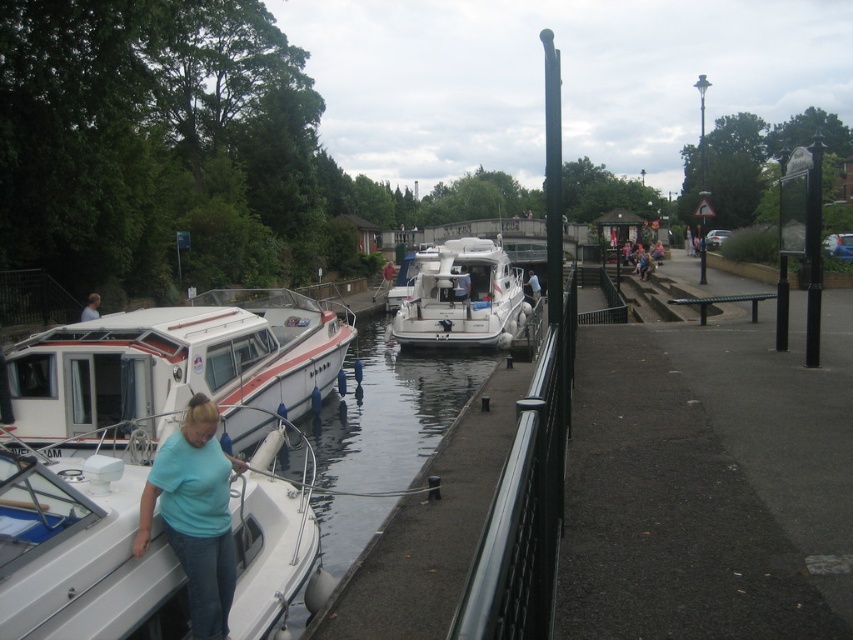
Question: Does light blue cotton shirt at lower left have a greater width compared to light blue shirt at lower left?

Choices:
 (A) no
 (B) yes

Answer: (B)

Question: Does white glossy boat at left appear under white glossy motorboat at center?

Choices:
 (A) no
 (B) yes

Answer: (B)

Question: Which point is closer to the camera taking this photo?

Choices:
 (A) (277, 554)
 (B) (531, 288)

Answer: (A)

Question: Which of the following is the farthest from the observer?

Choices:
 (A) tap(57, 547)
 (B) tap(538, 298)
 (C) tap(210, 412)

Answer: (B)

Question: Which point is farther to the camera?

Choices:
 (A) white glossy motorboat at center
 (B) blue fabric shirt at center
 (C) white glossy boat at lower left
 (D) light blue cotton shirt at lower left

Answer: (B)

Question: Is the position of white glossy boat at lower left more distant than that of light blue shirt at lower left?

Choices:
 (A) no
 (B) yes

Answer: (A)